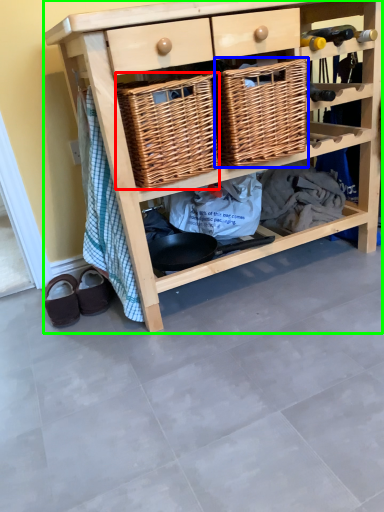
Question: Based on their relative distances, which object is farther from basket (highlighted by a red box)? Choose from basket (highlighted by a blue box) and shelf (highlighted by a green box).

Choices:
 (A) basket
 (B) shelf

Answer: (B)